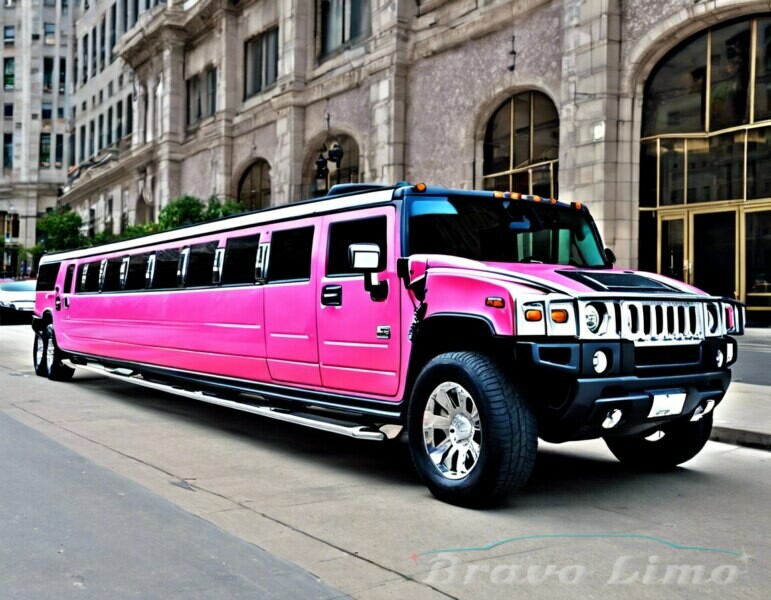
At what (x,y) coordinates should I click in order to perform the action: click on door handle. Please return your answer as a coordinate pair (x, y). Looking at the image, I should click on point(328,296), point(66,303), point(55,302).